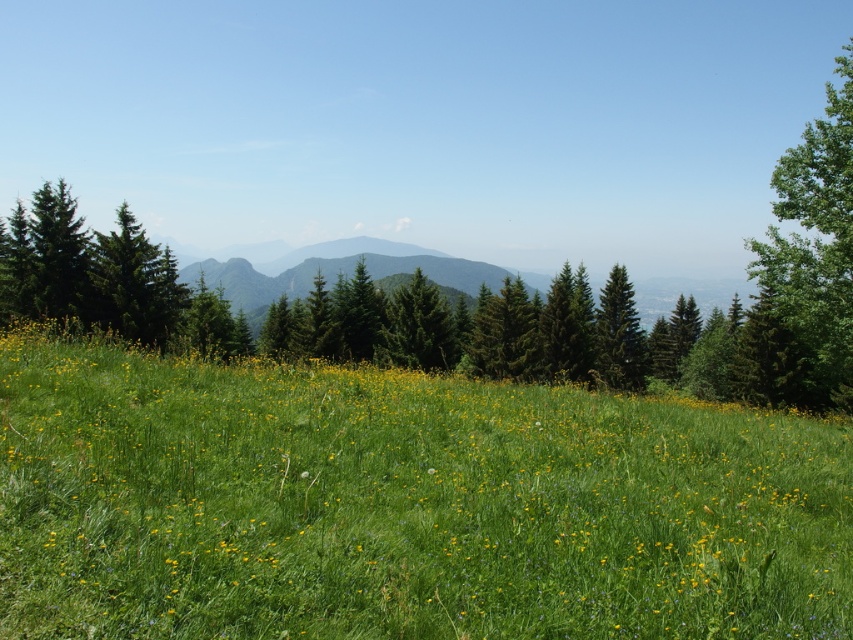
Which is in front, point (102, 273) or point (647, 362)?

Positioned in front is point (102, 273).

Is green matte tree at left below green matte tree at right?

No, green matte tree at left is not below green matte tree at right.

This screenshot has width=853, height=640. What do you see at coordinates (134, 284) in the screenshot? I see `green matte tree at left` at bounding box center [134, 284].

Locate an element on the screen. The width and height of the screenshot is (853, 640). green matte tree at left is located at coordinates (x=134, y=284).

Is green grass at center above green matte tree at left?

No, green grass at center is not above green matte tree at left.

Does green grass at center appear on the left side of green matte tree at left?

Incorrect, green grass at center is not on the left side of green matte tree at left.

Who is more forward, (73, 420) or (131, 332)?

Point (73, 420) is in front.

At what (x,y) coordinates should I click in order to perform the action: click on green grass at center. Please return your answer as a coordinate pair (x, y). Looking at the image, I should click on (402, 506).

Between green grass at center and green matte tree at right, which one has less height?

With less height is green grass at center.

Is point (154, 573) behind point (645, 369)?

That is False.

Describe the element at coordinates (402, 506) in the screenshot. This screenshot has width=853, height=640. I see `green grass at center` at that location.

Find the location of a particular element. Image resolution: width=853 pixels, height=640 pixels. green grass at center is located at coordinates (402, 506).